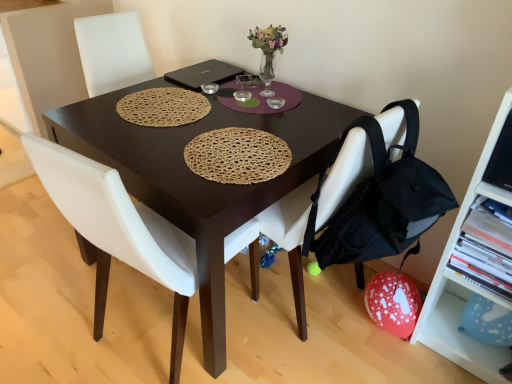
The image size is (512, 384). Identify the location of vacant space underneath translucent glass vase at upper center (from a real-world perspective). (268, 87).